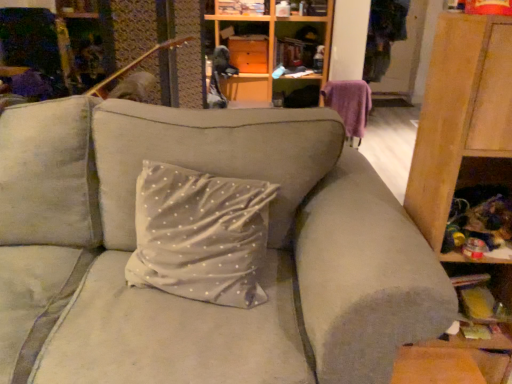
Question: Considering the positions of wooden cabinet at right and purple fabric swivel chair at upper right in the image, is wooden cabinet at right taller or shorter than purple fabric swivel chair at upper right?

Choices:
 (A) short
 (B) tall

Answer: (B)

Question: From the image's perspective, is wooden cabinet at right positioned above or below purple fabric swivel chair at upper right?

Choices:
 (A) above
 (B) below

Answer: (B)

Question: Estimate the real-world distances between objects in this image. Which object is farther from the light gray fabric couch at center?

Choices:
 (A) purple fabric swivel chair at upper right
 (B) wooden cabinet at right
 (C) matte wood cabinet at upper center

Answer: (C)

Question: Which object is positioned closest to the wooden cabinet at right?

Choices:
 (A) matte wood cabinet at upper center
 (B) purple fabric swivel chair at upper right
 (C) light gray fabric couch at center

Answer: (C)